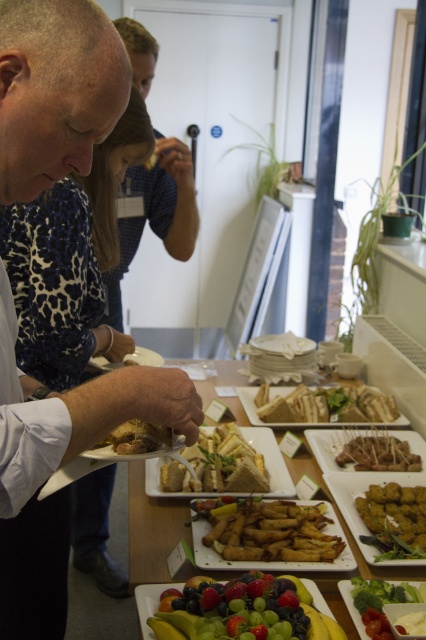
Question: Which of these objects is positioned closest to the matte brown bread at center?

Choices:
 (A) golden brown croutons at center
 (B) matte wooden table at center
 (C) golden crispy spring rolls at center
 (D) glossy plastic platter at lower center

Answer: (D)

Question: Is white bread sandwich at center bigger than brown crispy skewers at center?

Choices:
 (A) yes
 (B) no

Answer: (A)

Question: Which of the following is the closest to the observer?

Choices:
 (A) (350, 449)
 (B) (135, 433)
 (C) (124, 401)

Answer: (C)

Question: Estimate the real-world distances between objects in this image. Which object is closer to the green leafy salad at center?

Choices:
 (A) white bread sandwich at center
 (B) white matte shirt at center
 (C) white bread at center
 (D) matte brown bread at center

Answer: (C)

Question: Does white matte shirt at center come behind white bread sandwich at center?

Choices:
 (A) yes
 (B) no

Answer: (B)

Question: Is the position of matte wooden table at center more distant than that of golden brown croutons at center?

Choices:
 (A) yes
 (B) no

Answer: (B)